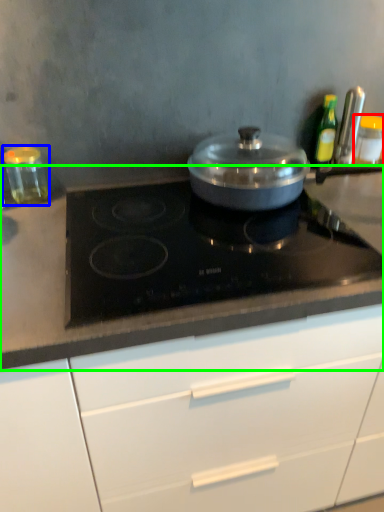
Question: Considering the real-world distances, which object is farthest from kitchen appliance (highlighted by a red box)? kitchen appliance (highlighted by a blue box) or countertop (highlighted by a green box)?

Choices:
 (A) kitchen appliance
 (B) countertop

Answer: (A)